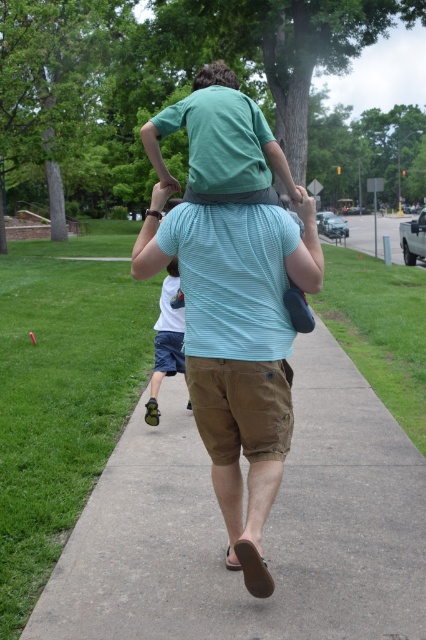
You are a photographer standing at the edge of the sidewalk. You want to take a photo of the light blue striped shirt at center and the light blue shorts at center. If your camera can focus on objects within 1.5 meters, will both items be in focus?

The light blue striped shirt at center is 1.65 meters away from light blue shorts at center. Since the camera can only focus within 1.5 meters, the distance between them exceeds the focus range. Therefore, both items may not be in focus simultaneously.

You are a photographer standing on the concrete at center. You want to take a photo of the two children. The first child is on the man on the shoulders, and the second child is walking ahead. How far apart are the two children from each other?

The two children are 10.03 feet apart.

You are standing on the sidewalk and see the dark brown hair at upper center and the concrete at center. Which object is located to the right of the other?

The concrete at center is to the right of the dark brown hair at upper center.